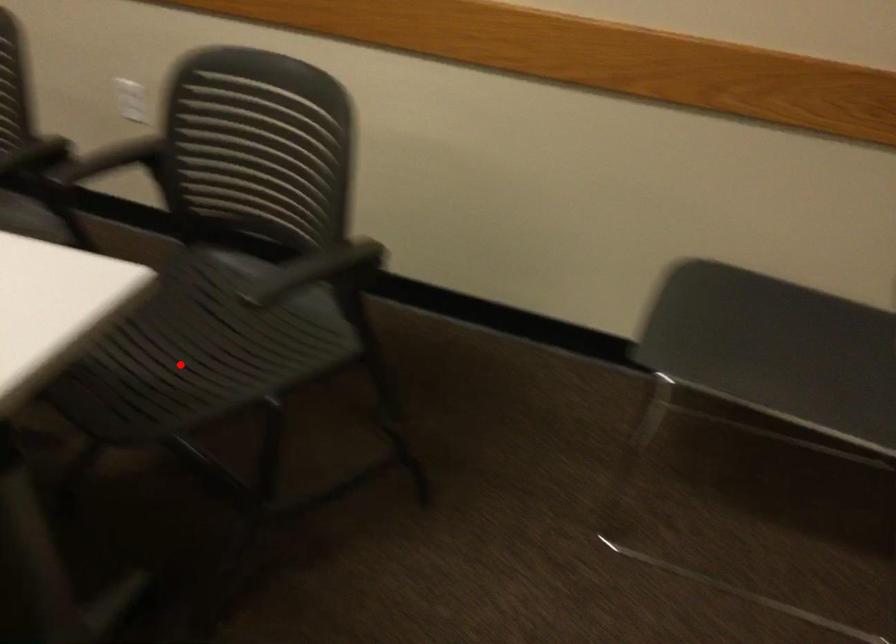
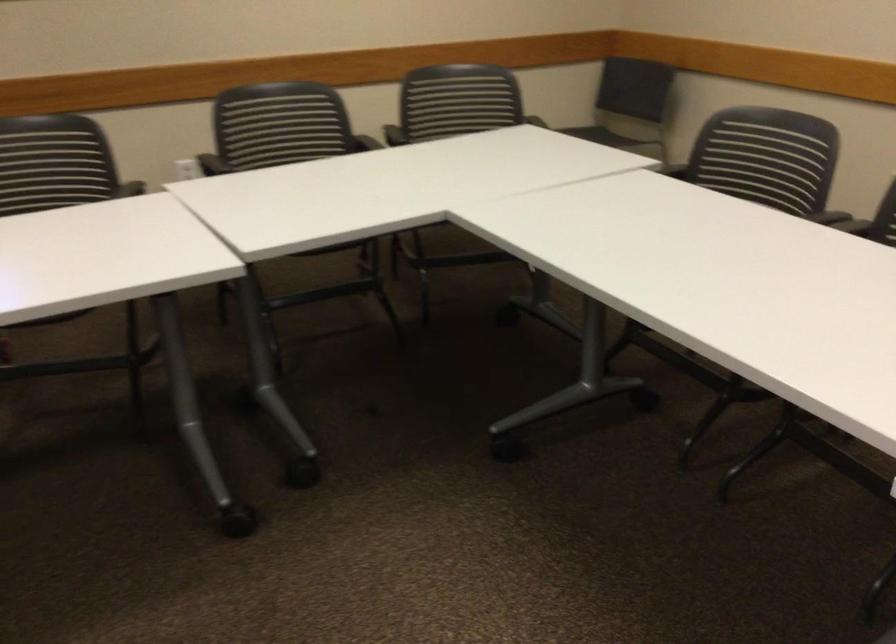
Question: I am providing you with two images of the same scene from different viewpoints. A red point is marked on the first image. At the location where the point appears in image 1, is it still visible in image 2?

Choices:
 (A) Yes
 (B) No

Answer: (B)